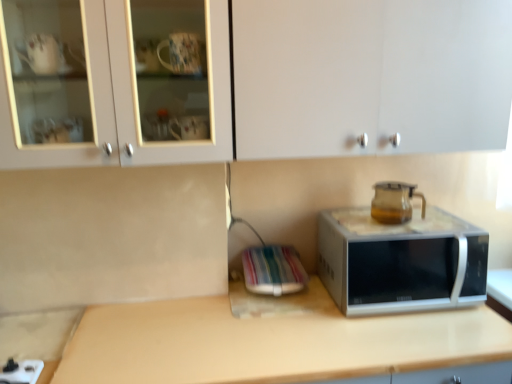
Question: Do you think beige laminate countertop at center is within white glossy cabinet at upper center, or outside of it?

Choices:
 (A) inside
 (B) outside

Answer: (B)

Question: Considering the relative positions of beige laminate countertop at center and white glossy cabinet at upper center in the image provided, is beige laminate countertop at center to the left or to the right of white glossy cabinet at upper center?

Choices:
 (A) right
 (B) left

Answer: (A)

Question: Which of these objects is positioned farthest from the white glossy cabinet at upper center?

Choices:
 (A) beige laminate countertop at center
 (B) transparent glass coffeepot at upper right
 (C) silver metallic microwave at center

Answer: (B)

Question: Estimate the real-world distances between objects in this image. Which object is closer to the beige laminate countertop at center?

Choices:
 (A) transparent glass coffeepot at upper right
 (B) white glossy cabinet at upper center
 (C) silver metallic microwave at center

Answer: (C)